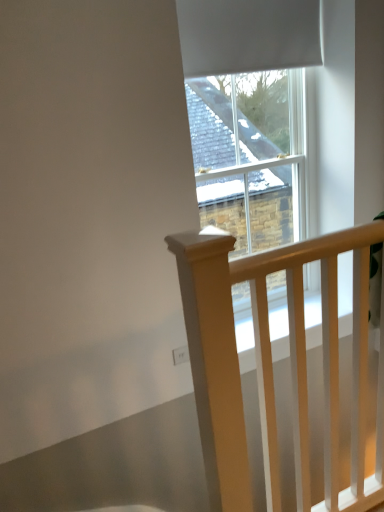
This screenshot has width=384, height=512. I want to click on white matte curtain at upper center, so click(x=248, y=35).

Measure the distance between point (225, 15) and camera.

Point (225, 15) is 1.94 meters from camera.

The image size is (384, 512). What do you see at coordinates (248, 35) in the screenshot? I see `white matte curtain at upper center` at bounding box center [248, 35].

Find the location of a particular element. white matte curtain at upper center is located at coordinates click(248, 35).